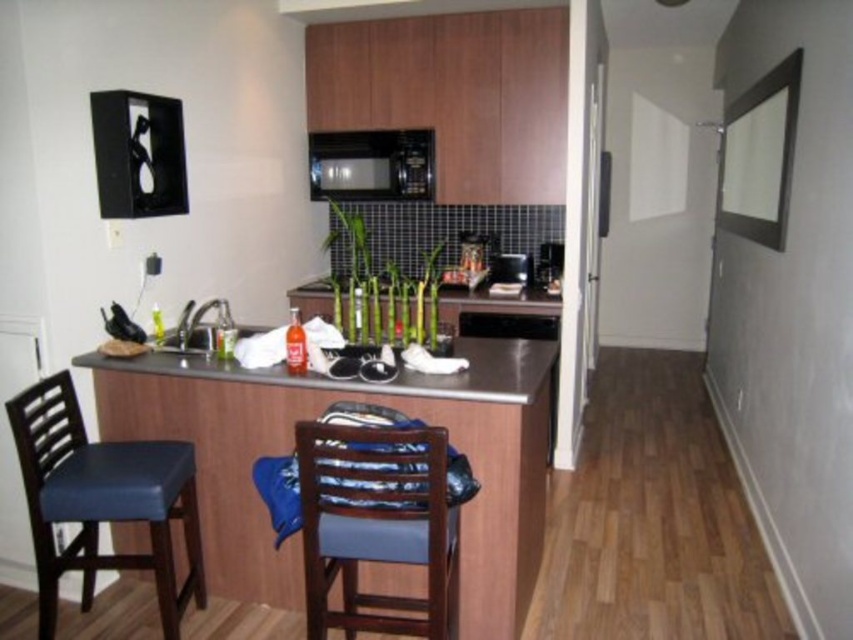
You are a delivery person who just arrived at the apartment. You need to place a package on the counter near the matte stainless steel sink at center. However, there is a blue leather chair at left in the way. Can you move the chair to the side to access the sink area?

The blue leather chair at left is to the left of the matte stainless steel sink at center, so you can move it to the left side to access the sink area.

You are a chef preparing a dish and need to place a heavy pot on a stable surface. Given the image, which object between the stainless steel counter at center and the matte stainless steel sink at center would be more suitable for placing the pot?

The stainless steel counter at center has a lesser height compared to the matte stainless steel sink at center, so the stainless steel counter at center would be more suitable for placing the heavy pot as it provides a lower and potentially more stable surface.